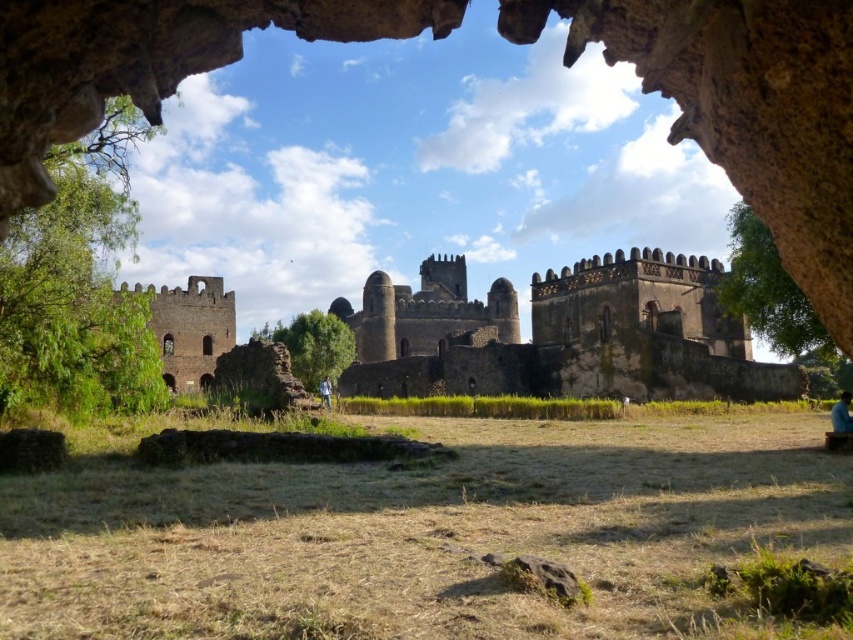
Question: Which object is the closest to the blue fabric person at lower right?

Choices:
 (A) brown stone fort at left
 (B) blue denim jeans at lower center

Answer: (B)

Question: Is brown stone fort at left behind blue fabric person at lower right?

Choices:
 (A) yes
 (B) no

Answer: (A)

Question: Does brown stone fort at left appear over blue denim jeans at lower center?

Choices:
 (A) no
 (B) yes

Answer: (B)

Question: Is blue fabric person at lower right below blue denim jeans at lower center?

Choices:
 (A) no
 (B) yes

Answer: (A)

Question: Estimate the real-world distances between objects in this image. Which object is farther from the blue fabric person at lower right?

Choices:
 (A) blue denim jeans at lower center
 (B) brown stone fort at left

Answer: (B)

Question: Which point is closer to the camera?

Choices:
 (A) brown stone fort at left
 (B) blue denim jeans at lower center

Answer: (A)